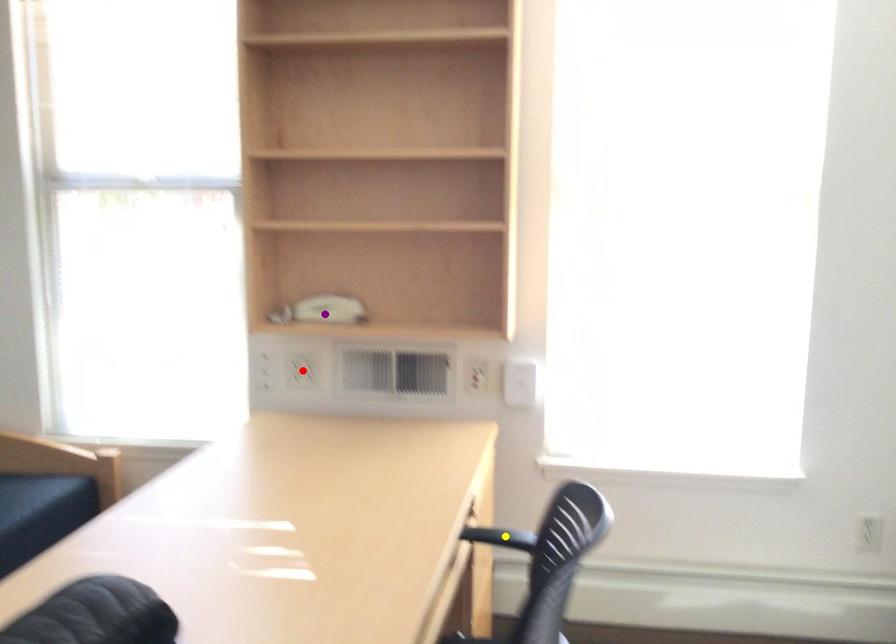
Consider the image. Order these from nearest to farthest:
red point
purple point
yellow point

yellow point
purple point
red point